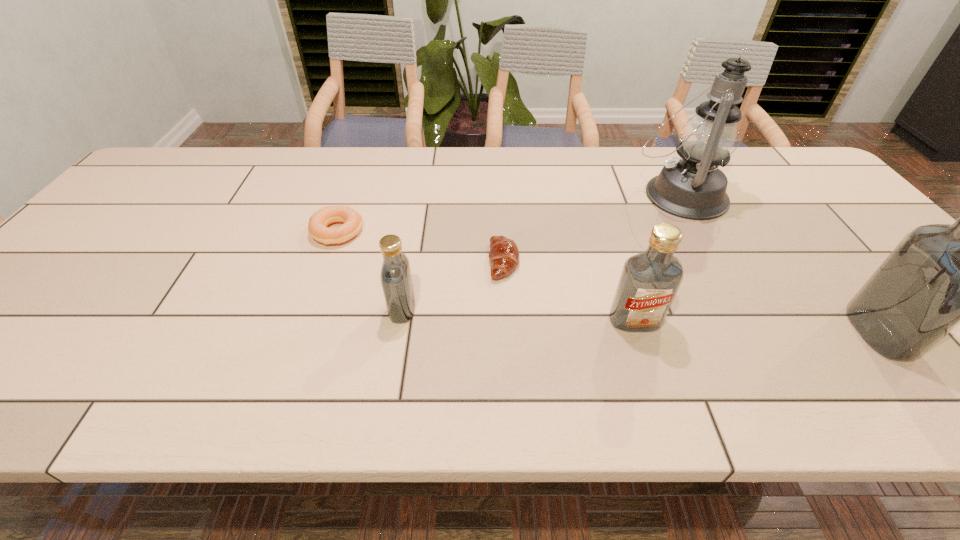
Considering the uniform spacing of vodkas, where should an additional vodka be positioned on the left? Please locate a free spot. Please provide its 2D coordinates. Your answer should be formatted as a tuple, i.e. [(x, y)], where the tuple contains the x and y coordinates of a point satisfying the conditions above.

[(180, 298)]